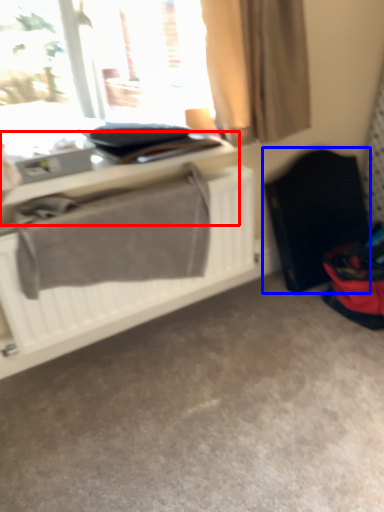
Question: Which object appears farthest to the camera in this image, table (highlighted by a red box) or folding chair (highlighted by a blue box)?

Choices:
 (A) table
 (B) folding chair

Answer: (B)